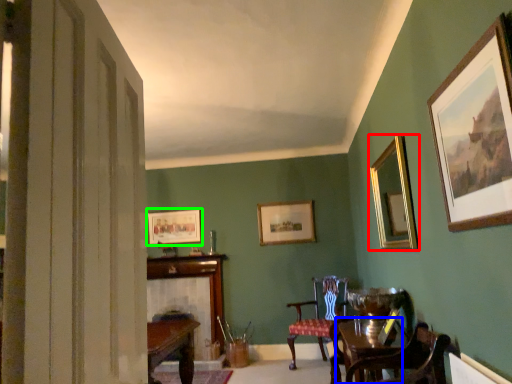
Question: Based on their relative distances, which object is farther from picture frame (highlighted by a red box)? Choose from round table (highlighted by a blue box) and picture frame (highlighted by a green box).

Choices:
 (A) round table
 (B) picture frame

Answer: (B)